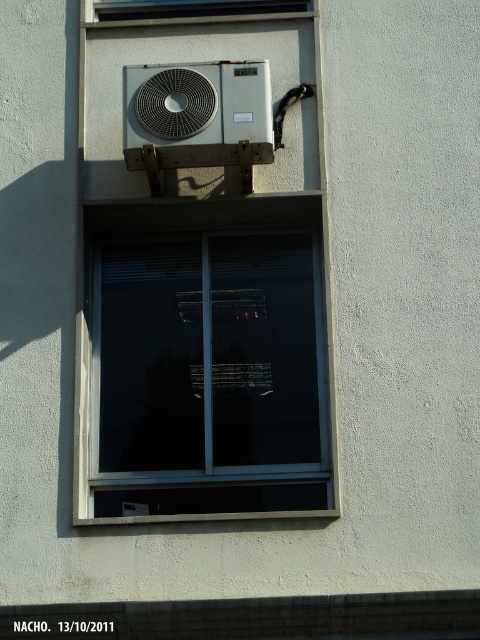
Question: Which of the following is the closest to the observer?

Choices:
 (A) transparent glass window at center
 (B) silver metallic air conditioner at upper center
 (C) transparent glass window at upper center

Answer: (A)

Question: Can you confirm if transparent glass window at center is positioned above transparent glass window at upper center?

Choices:
 (A) yes
 (B) no

Answer: (B)

Question: Among these objects, which one is farthest from the camera?

Choices:
 (A) transparent glass window at upper center
 (B) silver metallic air conditioner at upper center
 (C) transparent glass window at center

Answer: (A)

Question: In this image, where is transparent glass window at center located relative to transparent glass window at upper center?

Choices:
 (A) above
 (B) below

Answer: (B)

Question: Which object is positioned farthest from the transparent glass window at center?

Choices:
 (A) silver metallic air conditioner at upper center
 (B) transparent glass window at upper center

Answer: (B)

Question: Does silver metallic air conditioner at upper center have a larger size compared to transparent glass window at upper center?

Choices:
 (A) no
 (B) yes

Answer: (B)